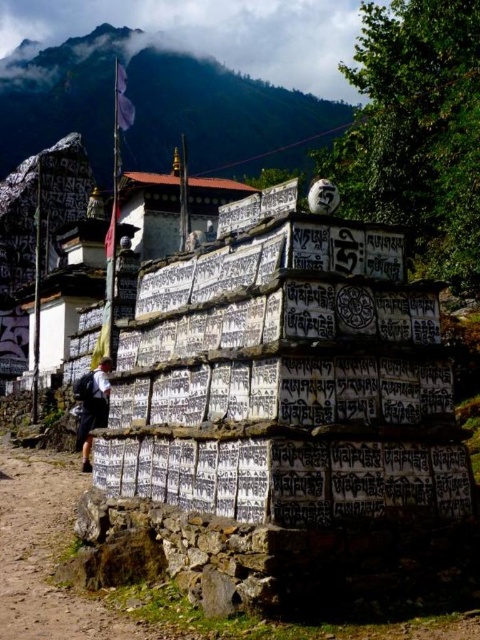
You are standing at the center of the mountain landscape and see the point marked at coordinates (285, 412). What object is located at this point?

The point at coordinates (285, 412) marks the location of the white stone prayer wheel at center.

You are standing in front of the mountain landscape and want to take a photo. There are two points marked in the image. The first point is at coordinates point (364, 349) and the second is at point (61, 476). Which point is closer to your camera when taking the photo?

Point (364, 349) is closer to the camera than point (61, 476).

You are a hiker who wants to place your white fabric backpack at lower left on the ground next to the brown dirt track at lower left. Based on the scene, can you safely place it there without blocking the path?

The brown dirt track at lower left is positioned on the right side of white fabric backpack at lower left, so placing the backpack there would block the path. Choose another spot to the left of the backpack instead.